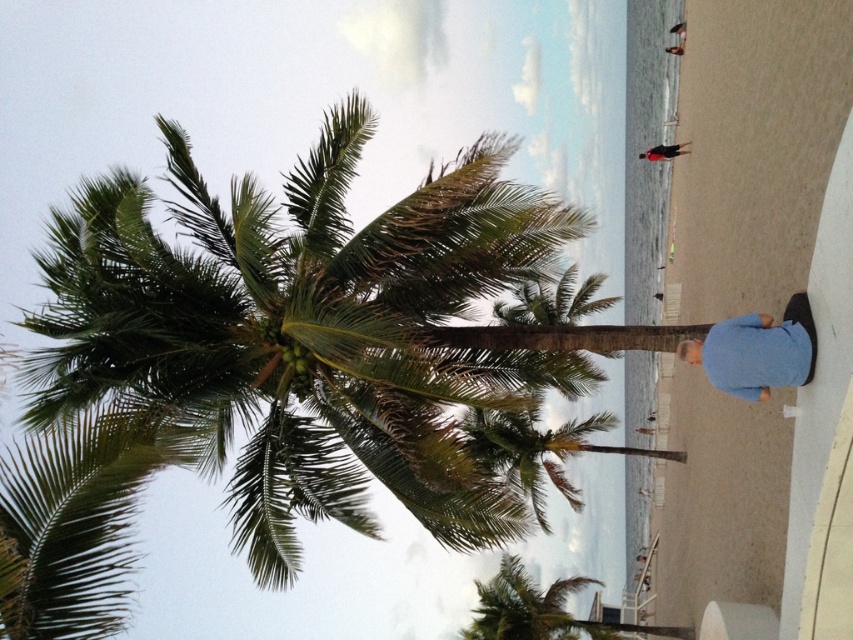
Does blue cotton shirt at lower right have a larger size compared to blue shirt at center?

Correct, blue cotton shirt at lower right is larger in size than blue shirt at center.

Who is shorter, blue cotton shirt at lower right or blue shirt at center?

blue shirt at center

Between point (729, 321) and point (677, 26), which one is positioned behind?

The point (677, 26) is more distant.

Locate an element on the screen. The height and width of the screenshot is (640, 853). blue cotton shirt at lower right is located at coordinates (757, 352).

This screenshot has width=853, height=640. Describe the element at coordinates (312, 339) in the screenshot. I see `green leafy coconut tree at center` at that location.

Is point (310, 419) positioned after point (805, 364)?

Yes, point (310, 419) is behind point (805, 364).

Find the location of `green leafy coconut tree at center`. green leafy coconut tree at center is located at coordinates (312, 339).

Does green leafy coconut tree at center have a greater width compared to dark blue shirt at center?

Yes.

Does green leafy coconut tree at center have a larger size compared to dark blue shirt at center?

Correct, green leafy coconut tree at center is larger in size than dark blue shirt at center.

The image size is (853, 640). I want to click on green leafy coconut tree at center, so click(x=312, y=339).